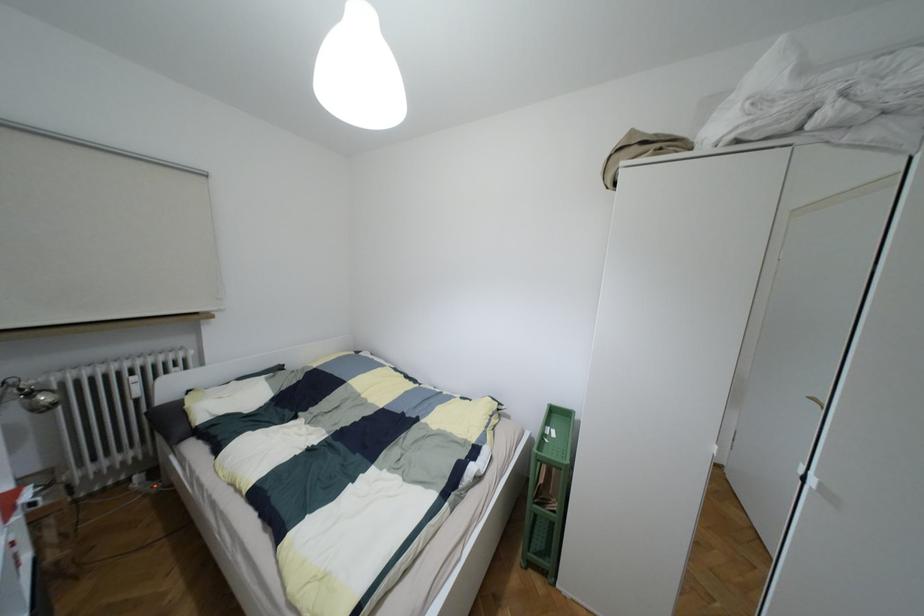
Find where to adjust the silver lamp head. Please return your answer as a coordinate pair (x, y).

(35, 397)